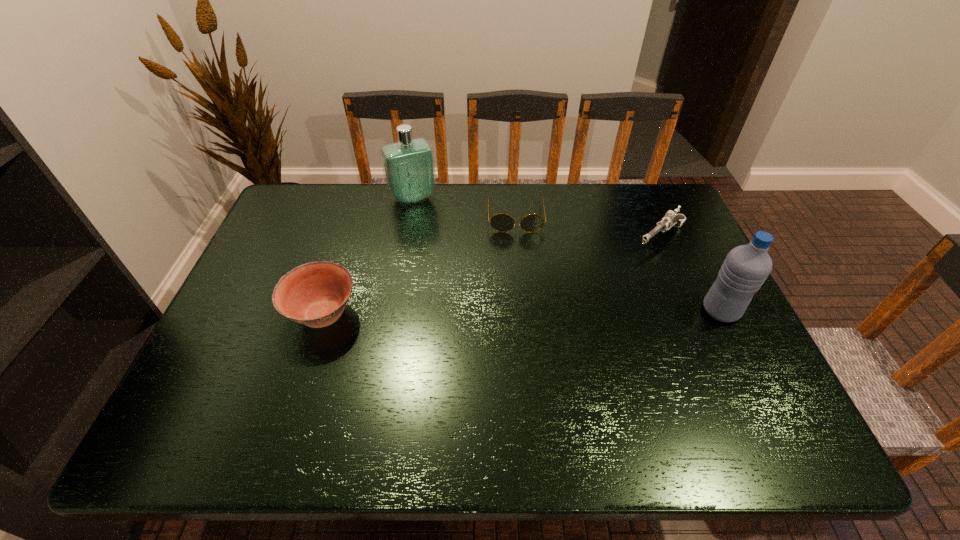
I want to click on object located at the left edge, so click(x=315, y=294).

Image resolution: width=960 pixels, height=540 pixels. What are the coordinates of `water bottle present at the right edge` in the screenshot? It's located at (746, 267).

At what (x,y) coordinates should I click in order to perform the action: click on gun located in the right edge section of the desktop. Please return your answer as a coordinate pair (x, y). The width and height of the screenshot is (960, 540). Looking at the image, I should click on (670, 218).

Locate an element on the screen. object positioned at the far right corner is located at coordinates (670, 218).

In the image, there is a desktop. Where is `free space at the far edge`? free space at the far edge is located at coordinates (541, 204).

You are a GUI agent. You are given a task and a screenshot of the screen. Output one action in this format:
    pyautogui.click(x=<x>, y=<y>)
    Task: Click on the vacant space at the near edge of the desktop
    The image size is (960, 540).
    Given the screenshot: What is the action you would take?
    (x=422, y=395)

This screenshot has width=960, height=540. Identify the location of free space at the left edge of the desktop. (299, 234).

In the image, there is a desktop. Find the location of `free region at the right edge`. free region at the right edge is located at coordinates (682, 265).

Find the location of a particular element. The image size is (960, 540). free space at the far right corner of the desktop is located at coordinates (638, 227).

Locate an element on the screen. The image size is (960, 540). vacant area that lies between the water bottle and the gun is located at coordinates (690, 274).